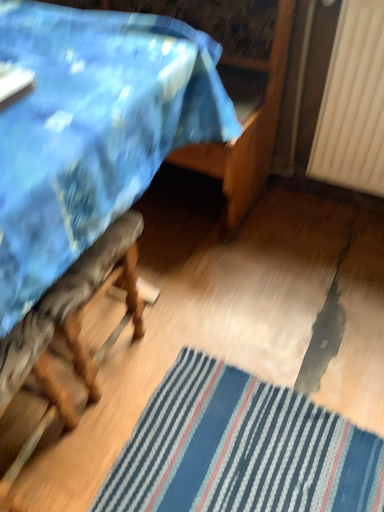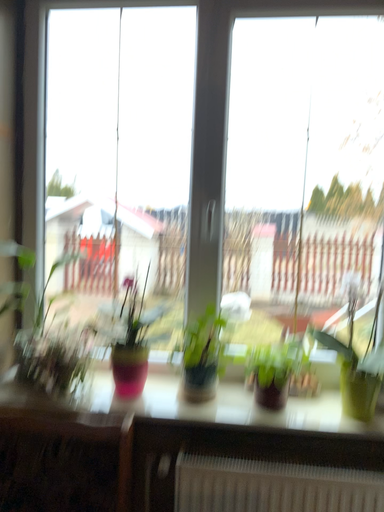
Question: How did the camera likely rotate when shooting the video?

Choices:
 (A) rotated upward
 (B) rotated downward

Answer: (A)